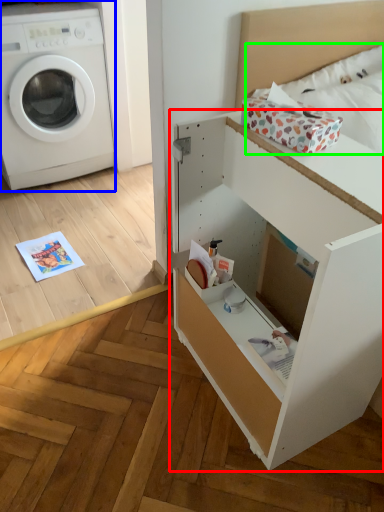
Question: Considering the real-world distances, which object is farthest from file cabinet (highlighted by a red box)? washing machine (highlighted by a blue box) or bedding (highlighted by a green box)?

Choices:
 (A) washing machine
 (B) bedding

Answer: (A)